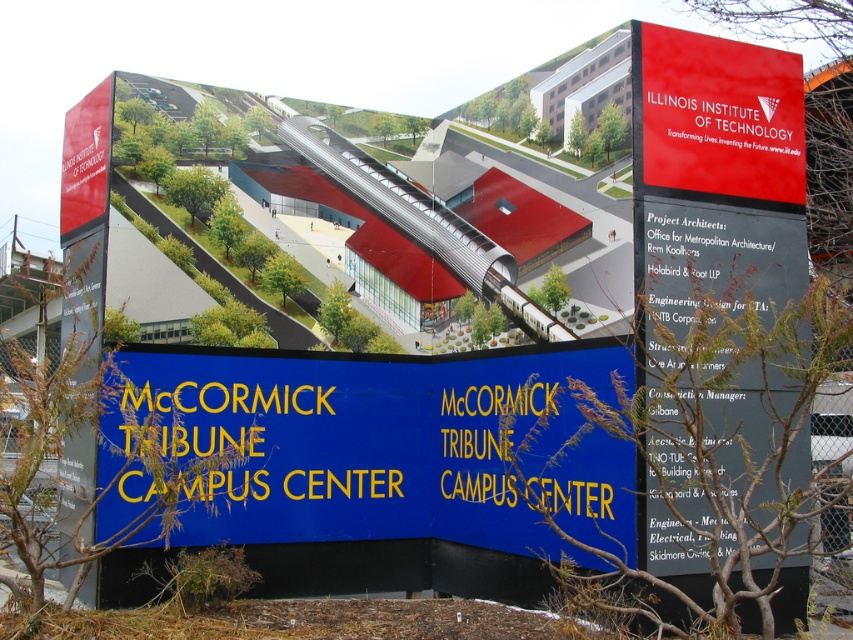
Question: Can you confirm if black matte sign at upper right is positioned above red matte sign at upper right?

Choices:
 (A) no
 (B) yes

Answer: (A)

Question: Does blue metallic sign at center have a larger size compared to red matte sign at upper right?

Choices:
 (A) no
 (B) yes

Answer: (B)

Question: Which point is closer to the camera?

Choices:
 (A) red matte sign at upper right
 (B) blue metallic sign at center
 (C) black matte sign at upper right

Answer: (C)

Question: Among these points, which one is nearest to the camera?

Choices:
 (A) (131, 388)
 (B) (697, 61)

Answer: (B)

Question: Is blue metallic sign at center above black matte sign at upper right?

Choices:
 (A) no
 (B) yes

Answer: (A)

Question: Which is nearer to the red matte sign at upper right?

Choices:
 (A) blue metallic sign at center
 (B) black matte sign at upper right

Answer: (B)